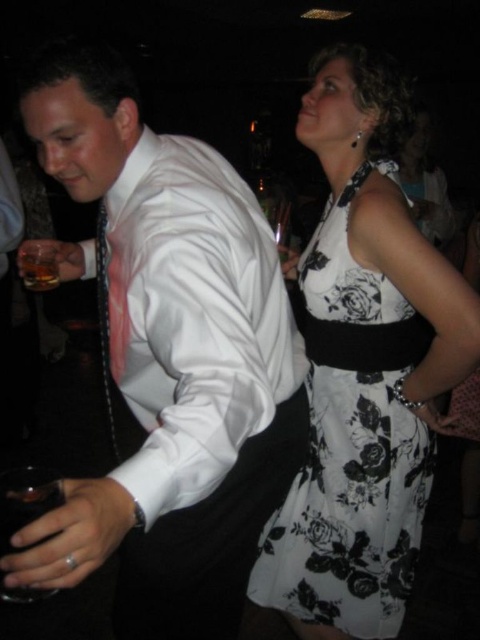
Which is more to the left, white satin shirt at left or translucent glass at lower left?

translucent glass at lower left is more to the left.

Which is in front, point (183, 493) or point (39, 266)?

Point (183, 493) is in front.

Describe the element at coordinates (166, 358) in the screenshot. I see `white satin shirt at left` at that location.

At what (x,y) coordinates should I click in order to perform the action: click on white satin shirt at left. Please return your answer as a coordinate pair (x, y). The width and height of the screenshot is (480, 640). Looking at the image, I should click on (166, 358).

The image size is (480, 640). What do you see at coordinates (424, 182) in the screenshot?
I see `white floral dress at upper right` at bounding box center [424, 182].

Does white floral dress at upper right have a larger size compared to translucent glass at lower left?

Indeed, white floral dress at upper right has a larger size compared to translucent glass at lower left.

Describe the element at coordinates (424, 182) in the screenshot. This screenshot has width=480, height=640. I see `white floral dress at upper right` at that location.

Locate an element on the screen. The image size is (480, 640). white floral dress at upper right is located at coordinates (424, 182).

Is transparent glass at lower left to the right of translucent glass at lower left from the viewer's perspective?

Indeed, transparent glass at lower left is positioned on the right side of translucent glass at lower left.

Who is positioned more to the left, transparent glass at lower left or translucent glass at lower left?

translucent glass at lower left

Is point (46, 595) positioned behind point (22, 262)?

No, it is in front of (22, 262).

At what (x,y) coordinates should I click in order to perform the action: click on transparent glass at lower left. Please return your answer as a coordinate pair (x, y). Looking at the image, I should click on (25, 499).